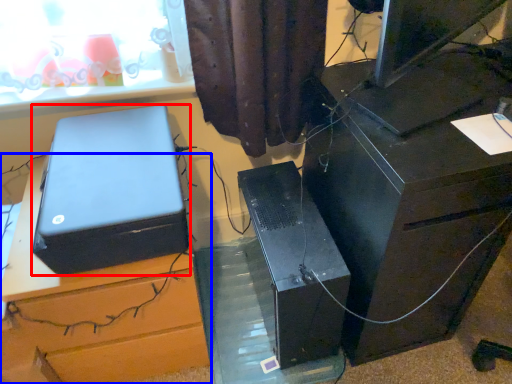
Question: Among these objects, which one is nearest to the camera, box (highlighted by a red box) or furniture (highlighted by a blue box)?

Choices:
 (A) box
 (B) furniture

Answer: (A)